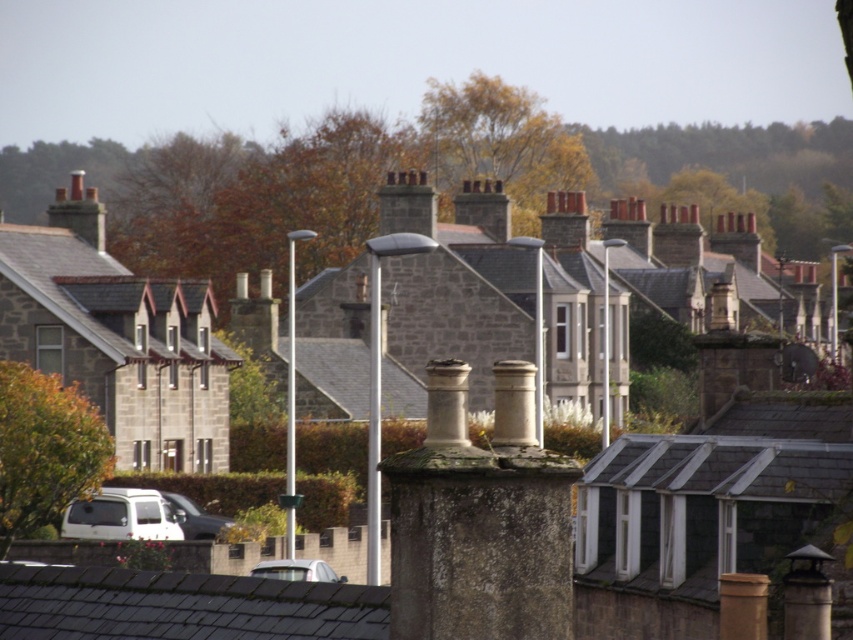
Question: Based on their relative distances, which object is farther from the silver metallic car at lower left?

Choices:
 (A) stone chimney at center
 (B) green leafy tree at lower left
 (C) white matte van at lower left
 (D) white matte car at lower center

Answer: (A)

Question: Can you confirm if green leafy tree at lower left is smaller than white matte van at lower left?

Choices:
 (A) yes
 (B) no

Answer: (A)

Question: Does green leafy tree at lower left have a greater width compared to silver metallic car at lower left?

Choices:
 (A) yes
 (B) no

Answer: (B)

Question: Which is farther from the stone chimney at center?

Choices:
 (A) green leafy tree at lower left
 (B) white matte car at lower center
 (C) silver metallic car at lower left
 (D) white matte van at lower left

Answer: (A)

Question: Which point is farther from the camera taking this photo?

Choices:
 (A) (276, 577)
 (B) (183, 509)
 (C) (402, 490)

Answer: (B)

Question: Is green leafy tree at lower left thinner than white matte car at lower center?

Choices:
 (A) yes
 (B) no

Answer: (A)